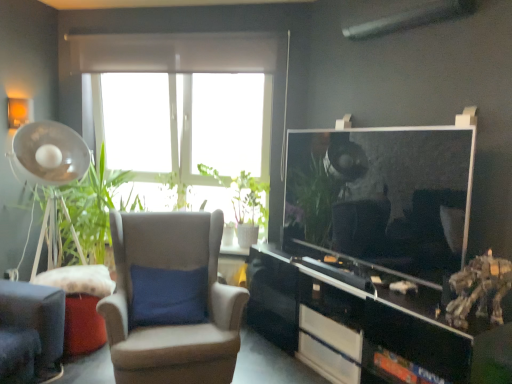
Question: In terms of size, does black glossy cabinet at lower right appear bigger or smaller than suede wingback chair at center?

Choices:
 (A) small
 (B) big

Answer: (A)

Question: In terms of height, does black glossy cabinet at lower right look taller or shorter compared to suede wingback chair at center?

Choices:
 (A) tall
 (B) short

Answer: (B)

Question: Considering the real-world distances, which object is farthest from the white glossy drawer at lower center, which is the 1th drawer in top-to-bottom order?

Choices:
 (A) black glossy cabinet at lower right
 (B) green matte plant at center
 (C) white glossy drawer at lower center, placed as the 2th drawer when sorted from top to bottom
 (D) suede wingback chair at center

Answer: (B)

Question: Which is farther from the suede wingback chair at center?

Choices:
 (A) green matte plant at center
 (B) white glossy drawer at lower center, placed as the first drawer when sorted from bottom to top
 (C) white glossy drawer at lower center, which is the 1th drawer in top-to-bottom order
 (D) black glossy cabinet at lower right

Answer: (A)